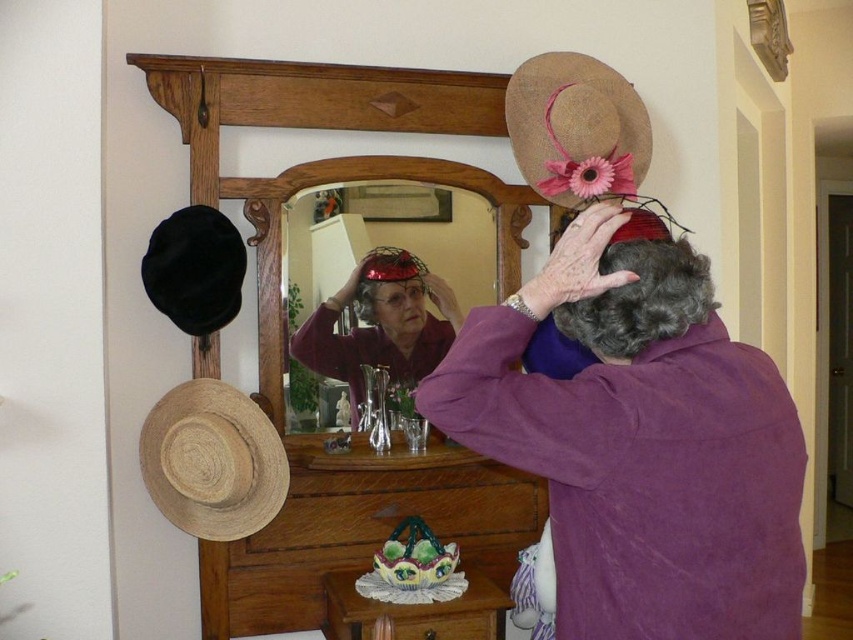
Is purple matte shirt at center smaller than matte plastic mirror at center?

No.

Is purple matte shirt at center above matte plastic mirror at center?

No.

Is point (688, 480) closer to camera compared to point (302, 221)?

Yes, point (688, 480) is closer to viewer.

Image resolution: width=853 pixels, height=640 pixels. What are the coordinates of `purple matte shirt at center` in the screenshot? It's located at (640, 442).

Which of these two, purple matte shirt at center or wooden drawer at lower center, stands shorter?

With less height is wooden drawer at lower center.

Which is more to the right, purple matte shirt at center or wooden drawer at lower center?

purple matte shirt at center is more to the right.

Where is `purple matte shirt at center`? purple matte shirt at center is located at coordinates (640, 442).

Measure the distance between purple matte shirt at center and wooden dresser at center.

purple matte shirt at center is 1.26 meters away from wooden dresser at center.

Consider the image. Can you confirm if purple matte shirt at center is thinner than wooden dresser at center?

Yes, purple matte shirt at center is thinner than wooden dresser at center.

Does point (637, 490) lie in front of point (508, 227)?

Yes, it is.

You are a GUI agent. You are given a task and a screenshot of the screen. Output one action in this format:
    pyautogui.click(x=<x>, y=<y>)
    Task: Click on the purple matte shirt at center
    Image resolution: width=853 pixels, height=640 pixels.
    Given the screenshot: What is the action you would take?
    pyautogui.click(x=640, y=442)